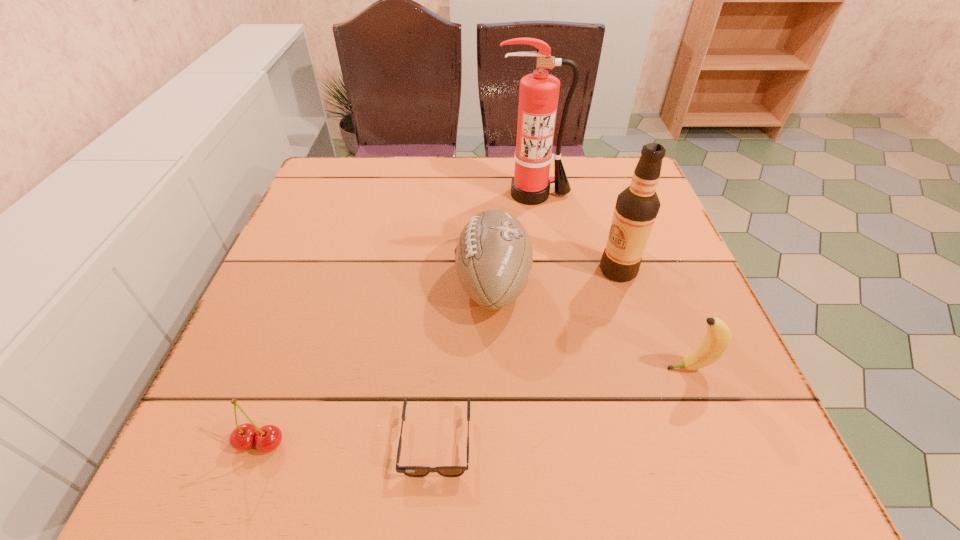
Locate an element on the screen. The height and width of the screenshot is (540, 960). the farthest object is located at coordinates (538, 96).

At what (x,y) coordinates should I click in order to perform the action: click on the tallest object. Please return your answer as a coordinate pair (x, y). Looking at the image, I should click on point(538,96).

Identify the location of the second tallest object. The width and height of the screenshot is (960, 540). (636, 209).

You are a GUI agent. You are given a task and a screenshot of the screen. Output one action in this format:
    pyautogui.click(x=<x>, y=<y>)
    Task: Click on the football (American)
    
    Given the screenshot: What is the action you would take?
    pyautogui.click(x=493, y=257)

I want to click on the third nearest object, so click(718, 337).

The height and width of the screenshot is (540, 960). I want to click on the leftmost object, so click(267, 438).

Locate an element on the screen. The width and height of the screenshot is (960, 540). cherry is located at coordinates (267, 438).

Find the location of `the shortest object`. the shortest object is located at coordinates (412, 471).

You are a GUI agent. You are given a task and a screenshot of the screen. Output one action in this format:
    pyautogui.click(x=<x>, y=<y>)
    Task: Click on the vacant region located 0.050m at the nozzle of the tallest object
    The width and height of the screenshot is (960, 540).
    Given the screenshot: What is the action you would take?
    pyautogui.click(x=537, y=218)

Locate an element on the screen. This screenshot has height=540, width=960. vacant space situated 0.200m on the label of the alcohol is located at coordinates coord(506,270).